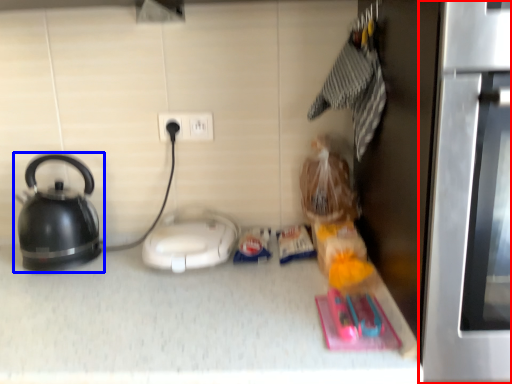
Question: Which of the following is the closest to the observer, oven (highlighted by a red box) or kettle (highlighted by a blue box)?

Choices:
 (A) oven
 (B) kettle

Answer: (A)